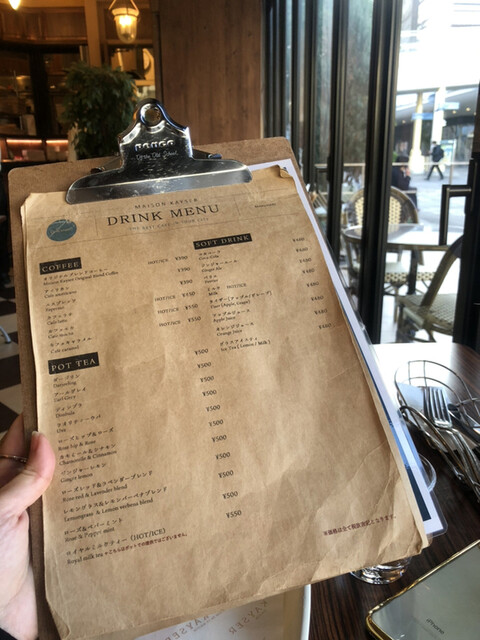
Locate an element on the screen. The height and width of the screenshot is (640, 480). light bulb is located at coordinates (126, 34).